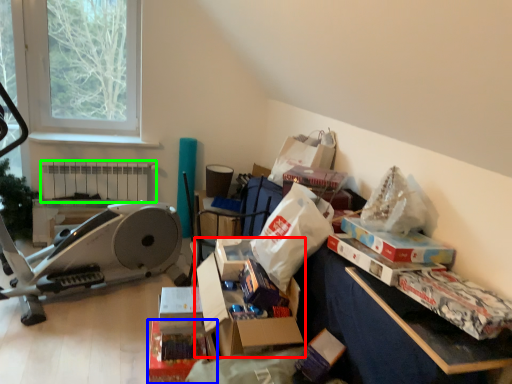
Question: Considering the real-world distances, which object is farthest from storage box (highlighted by a red box)? storage box (highlighted by a blue box) or radiator (highlighted by a green box)?

Choices:
 (A) storage box
 (B) radiator

Answer: (B)